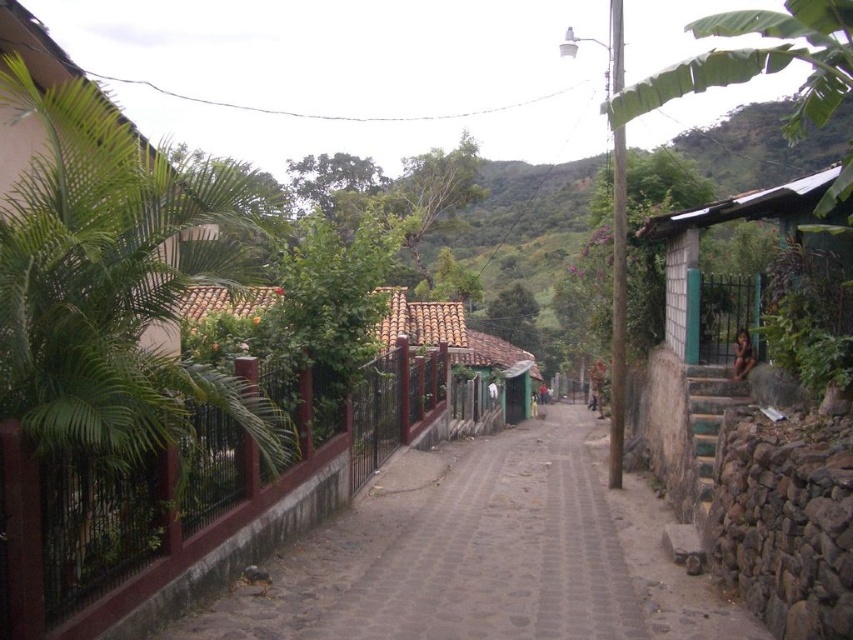
Based on the photo, can you confirm if brown cobblestone path at center is positioned to the right of green corrugated metal hut at right?

No, brown cobblestone path at center is not to the right of green corrugated metal hut at right.

Which is in front, point (618, 616) or point (660, 404)?

Positioned in front is point (618, 616).

Is point (320, 544) positioned before point (819, 172)?

Yes, it is.

I want to click on brown cobblestone path at center, so click(482, 556).